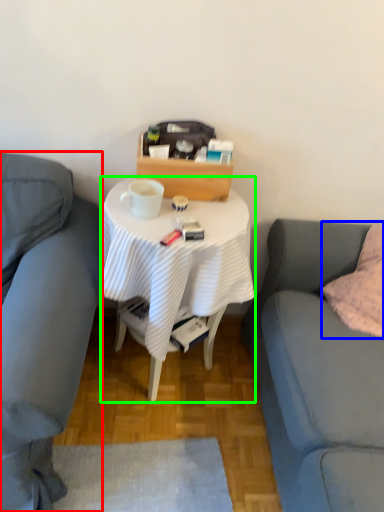
Question: Based on their relative distances, which object is farther from studio couch (highlighted by a red box)? Choose from pillow (highlighted by a blue box) and desk (highlighted by a green box).

Choices:
 (A) pillow
 (B) desk

Answer: (A)